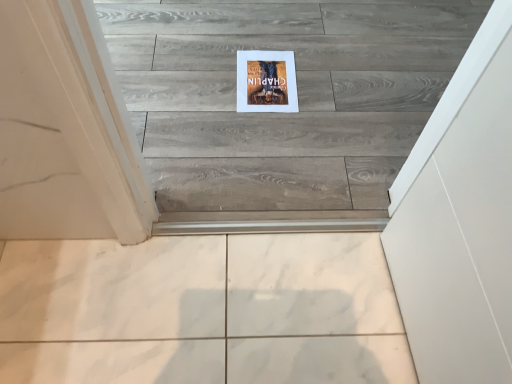
Where is `free space above white marble tile at lower center (from a real-world perspective)`? The image size is (512, 384). free space above white marble tile at lower center (from a real-world perspective) is located at coordinates (181, 300).